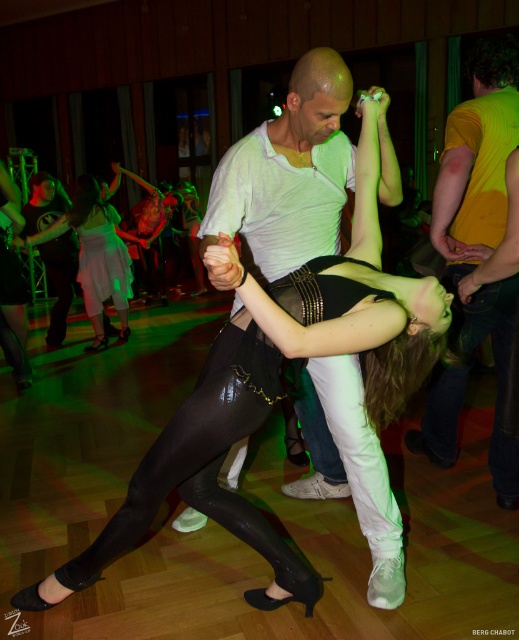
Where is `matte black tights at center`? matte black tights at center is located at coordinates (277, 376).

Which is below, matte black tights at center or black leather skirt at center?

matte black tights at center is below.

Which is behind, point (220, 385) or point (39, 240)?

Positioned behind is point (39, 240).

This screenshot has height=640, width=519. I want to click on matte black tights at center, so click(x=277, y=376).

Is matte white shirt at center below yellow matte shirt at upper right?

No, matte white shirt at center is not below yellow matte shirt at upper right.

Can you confirm if matte white shirt at center is shorter than yellow matte shirt at upper right?

Correct, matte white shirt at center is not as tall as yellow matte shirt at upper right.

Is point (253, 163) less distant than point (485, 38)?

Yes, it is in front of point (485, 38).

This screenshot has width=519, height=640. Identify the location of matte white shirt at center. coord(289,173).

Which of these two, matte white shirt at center or black leather skirt at center, stands shorter?

matte white shirt at center

Can you confirm if matte white shirt at center is positioned below black leather skirt at center?

Yes, matte white shirt at center is below black leather skirt at center.

Locate an element on the screen. This screenshot has height=640, width=519. matte white shirt at center is located at coordinates (289, 173).